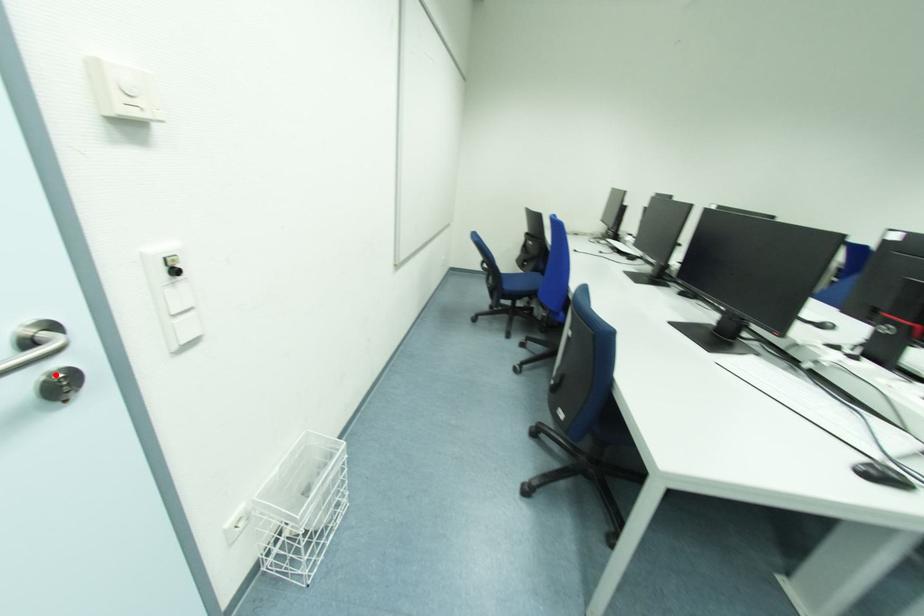
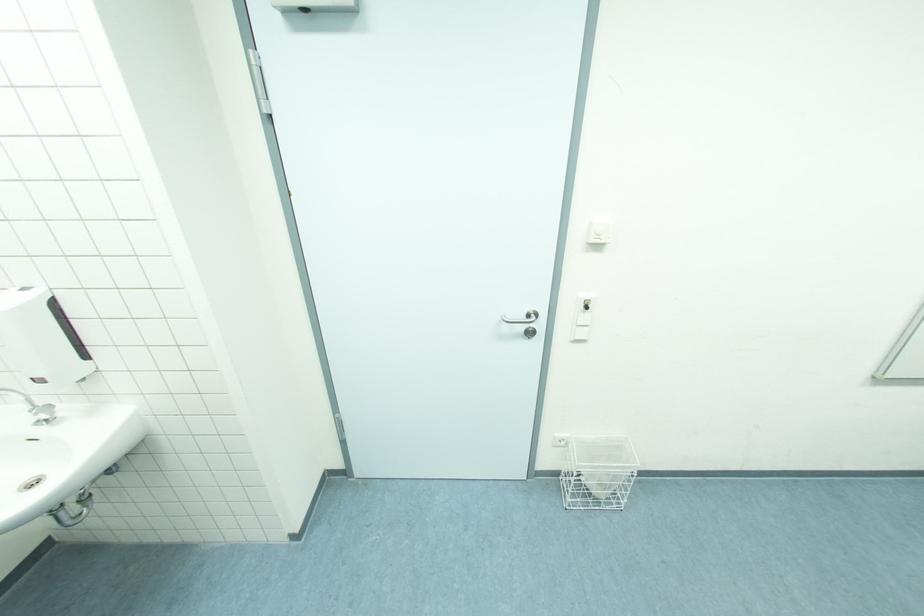
In the second image, find the point that corresponds to the highlighted location in the first image.

(532, 329)